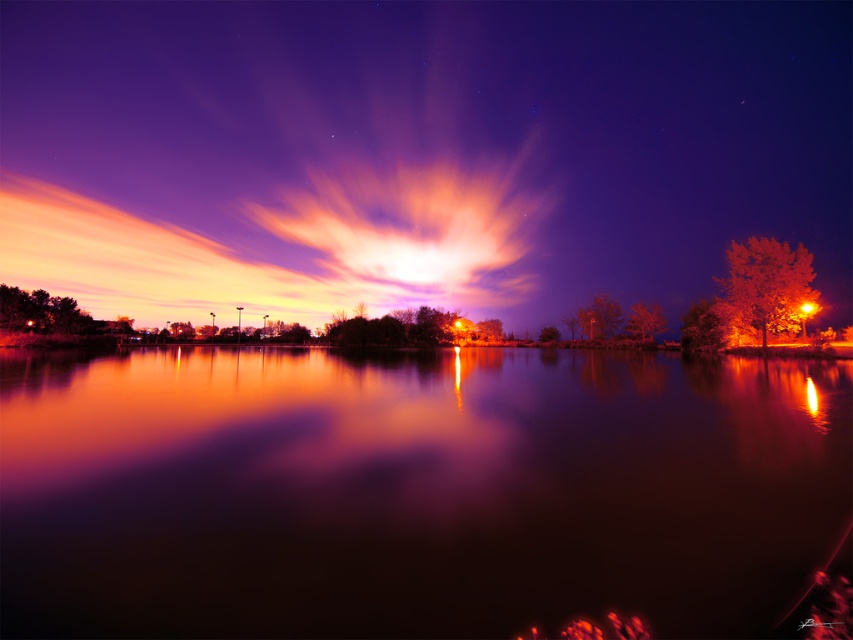
Question: Is glossy reflective water at center in front of radiant orange cloud at center?

Choices:
 (A) yes
 (B) no

Answer: (A)

Question: In this image, where is glossy reflective water at center located relative to radiant orange cloud at center?

Choices:
 (A) right
 (B) left

Answer: (A)

Question: Is glossy reflective water at center wider than radiant orange cloud at center?

Choices:
 (A) no
 (B) yes

Answer: (A)

Question: Which of the following is the closest to the observer?

Choices:
 (A) (387, 176)
 (B) (419, 513)

Answer: (B)

Question: Which point appears closest to the camera in this image?

Choices:
 (A) (15, 579)
 (B) (332, 228)

Answer: (A)

Question: Which point is closer to the camera taking this photo?

Choices:
 (A) (616, 525)
 (B) (514, 211)

Answer: (A)